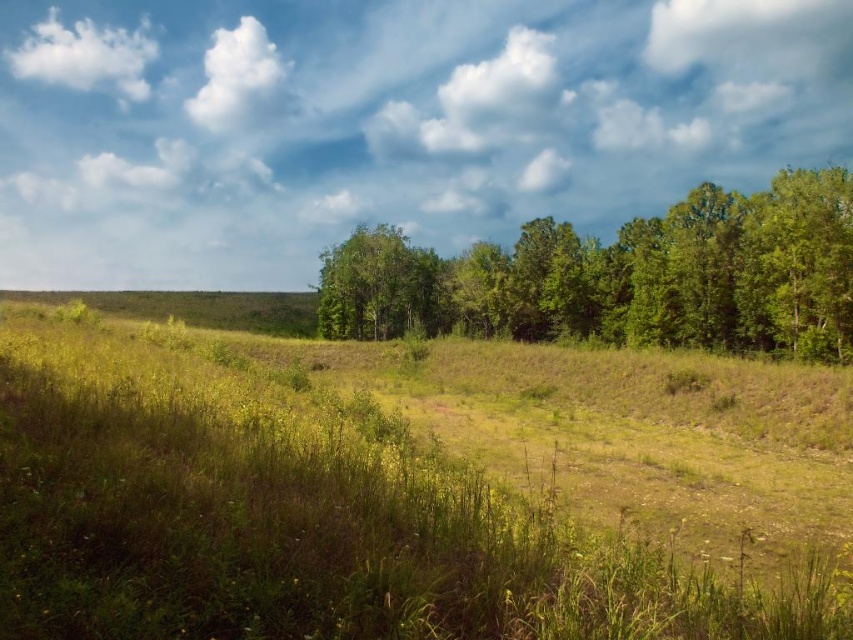
Question: Does white fluffy cloud at upper right appear under green leafy tree at center?

Choices:
 (A) yes
 (B) no

Answer: (B)

Question: Among these points, which one is nearest to the camera?

Choices:
 (A) (273, 48)
 (B) (677, 54)

Answer: (A)

Question: Estimate the real-world distances between objects in this image. Which object is farther from the green leafy trees at center?

Choices:
 (A) white fluffy cloud at upper left
 (B) white fluffy cloud at upper right
 (C) white fluffy cloud at upper center

Answer: (A)

Question: Does white fluffy cloud at upper left have a lesser width compared to white fluffy cloud at upper center?

Choices:
 (A) yes
 (B) no

Answer: (B)

Question: Which point is farther to the camera?

Choices:
 (A) (712, 204)
 (B) (743, 60)

Answer: (B)

Question: Does white fluffy cloud at upper right have a smaller size compared to green leafy tree at center?

Choices:
 (A) no
 (B) yes

Answer: (A)